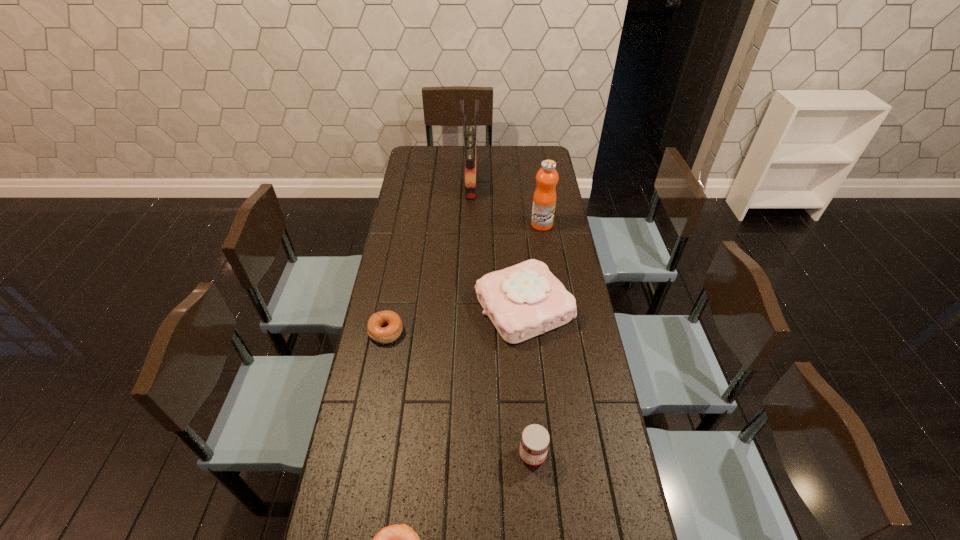
At what (x,y) coordinates should I click in order to perform the action: click on vacant region located 0.070m on the back of the fifth nearest object. Please return your answer as a coordinate pair (x, y). Looking at the image, I should click on (540, 208).

In order to click on free space located on the front of the cake in this screenshot , I will do `click(538, 454)`.

This screenshot has height=540, width=960. I want to click on free region located on the left of the third shortest object, so click(458, 455).

In order to click on vacant space located on the front of the farther bagel in this screenshot , I will do `click(376, 384)`.

In order to click on object at the far edge in this screenshot , I will do `click(469, 134)`.

Identify the location of object positioned at the left edge. The image size is (960, 540). (392, 321).

This screenshot has height=540, width=960. Find the location of `fruit juice situated at the right edge`. fruit juice situated at the right edge is located at coordinates (544, 200).

The height and width of the screenshot is (540, 960). Identify the location of cake situated at the right edge. (525, 300).

This screenshot has height=540, width=960. Find the location of `free spot at the far edge of the desktop`. free spot at the far edge of the desktop is located at coordinates (511, 168).

The height and width of the screenshot is (540, 960). I want to click on free region at the left edge of the desktop, so click(x=374, y=442).